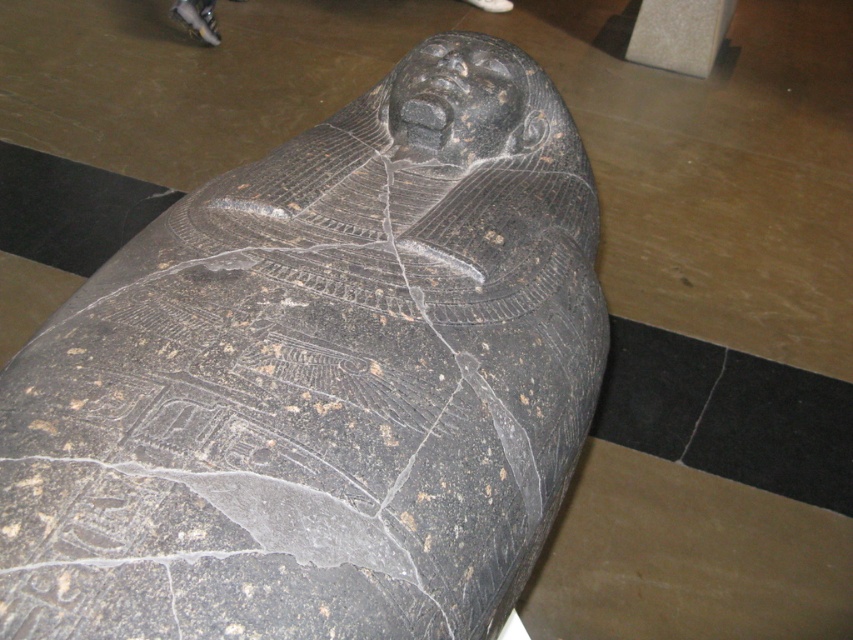
Question: Which point is closer to the camera?

Choices:
 (A) black stone sarcophagus at center
 (B) black stone crack at lower right
 (C) smooth gray stone at upper right

Answer: (A)

Question: Does black stone sarcophagus at center come behind black stone crack at lower right?

Choices:
 (A) yes
 (B) no

Answer: (B)

Question: Considering the relative positions of black stone sarcophagus at center and black stone crack at lower right in the image provided, where is black stone sarcophagus at center located with respect to black stone crack at lower right?

Choices:
 (A) right
 (B) left

Answer: (B)

Question: Estimate the real-world distances between objects in this image. Which object is farther from the black stone crack at lower right?

Choices:
 (A) smooth gray stone at upper right
 (B) black stone sarcophagus at center

Answer: (A)

Question: Does smooth gray stone at upper right appear on the left side of black stone crack at lower right?

Choices:
 (A) yes
 (B) no

Answer: (B)

Question: Which of the following is the farthest from the observer?

Choices:
 (A) (711, 401)
 (B) (386, 97)
 (C) (683, 6)

Answer: (C)